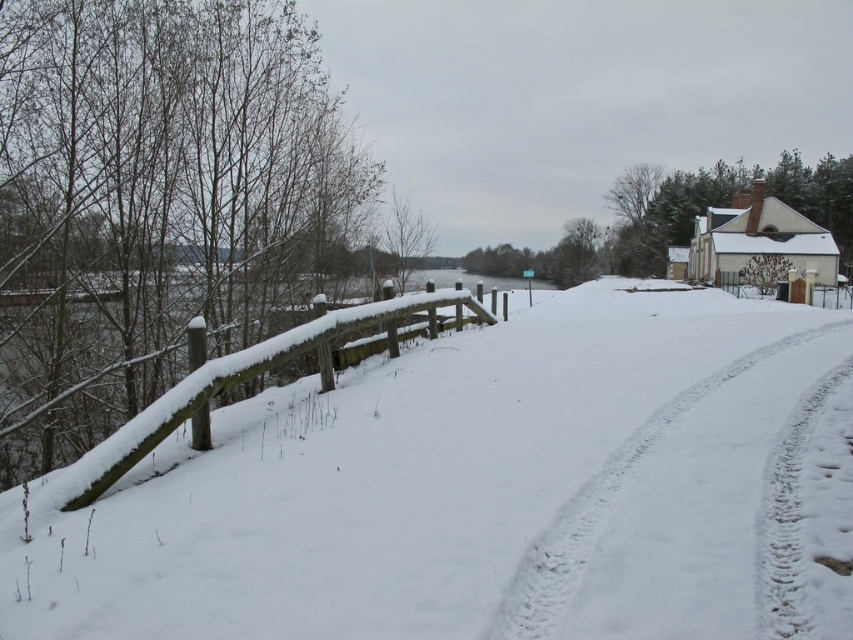
Is white snow path at center to the left of snow-covered wooden rail at left from the viewer's perspective?

In fact, white snow path at center is to the right of snow-covered wooden rail at left.

Is point (640, 433) in front of point (85, 477)?

No, (640, 433) is behind (85, 477).

Does point (576, 516) lie in front of point (152, 445)?

Yes, it is.

Identify the location of white snow path at center. The width and height of the screenshot is (853, 640). (602, 508).